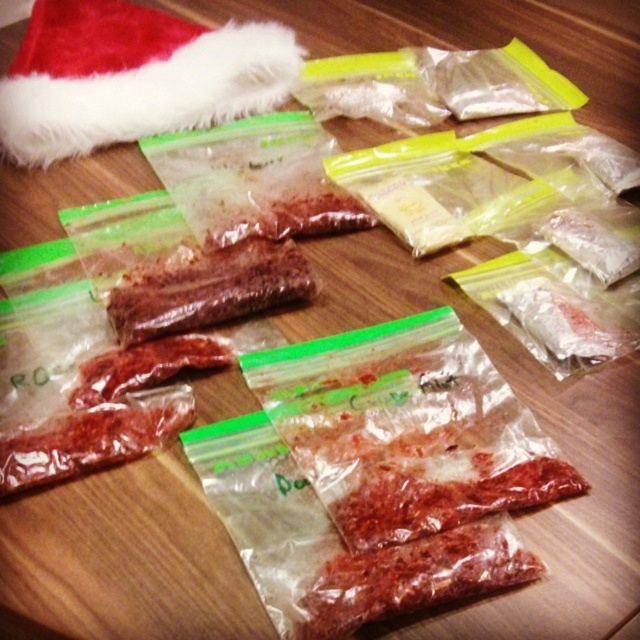
You are looking at the image and want to determine which of the two points, point (339, 618) or point (388, 538), is closer to you. Based on the scene, can you figure out which point is nearer?

Point (339, 618) is closer to the camera than point (388, 538), so it is the nearer one.

You are organizing the red matte meat at center and the red matte dried meat at lower left in a storage container. Which one should you place first to ensure proper stacking?

The red matte meat at center should be placed first because it has a smaller size compared to the red matte dried meat at lower left, allowing the larger item to support it safely.